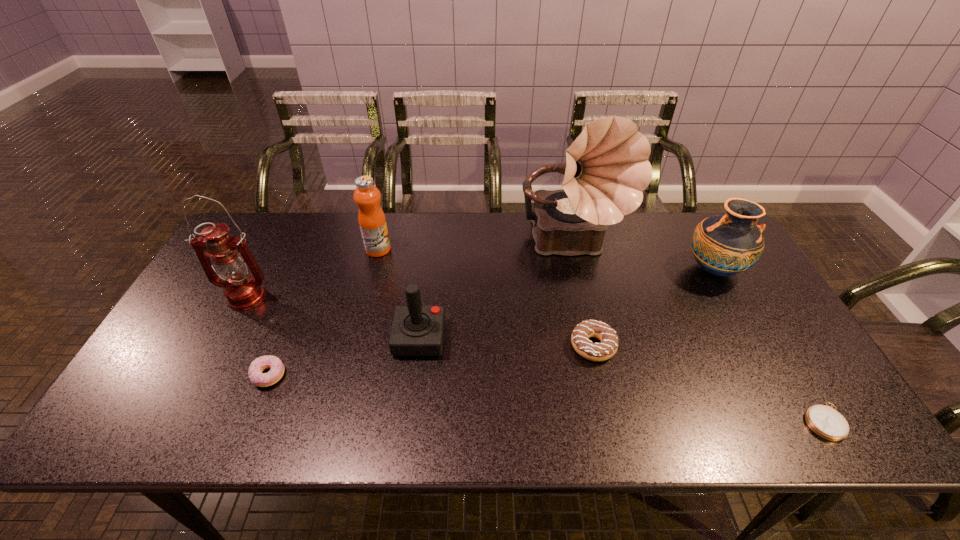
The image size is (960, 540). Find the location of `vacant space at the near edge of the desktop`. vacant space at the near edge of the desktop is located at coordinates (648, 417).

Identify the location of vacant space at the left edge of the desktop. The width and height of the screenshot is (960, 540). (197, 291).

In order to click on vacant space at the right edge in this screenshot , I will do `click(766, 382)`.

In order to click on free region at the near left corner of the desktop in this screenshot , I will do `click(159, 408)`.

This screenshot has height=540, width=960. What are the coordinates of `vacant region at the near right corner of the desktop` in the screenshot? It's located at (803, 420).

Where is `free space that is in between the pottery and the fourth shortest object`? The width and height of the screenshot is (960, 540). free space that is in between the pottery and the fourth shortest object is located at coordinates (566, 304).

The width and height of the screenshot is (960, 540). Identify the location of empty space that is in between the tallest object and the right doughnut. (583, 296).

You are a GUI agent. You are given a task and a screenshot of the screen. Output one action in this format:
    pyautogui.click(x=<x>, y=<y>)
    Task: Click on the free space between the pottery and the fifth object from right to left
    
    Given the screenshot: What is the action you would take?
    pyautogui.click(x=566, y=304)

Locate an element on the screen. The image size is (960, 540). free space between the pottery and the shorter doughnut is located at coordinates (492, 323).

Identify the location of free space between the second object from left to right and the second tallest object. (257, 336).